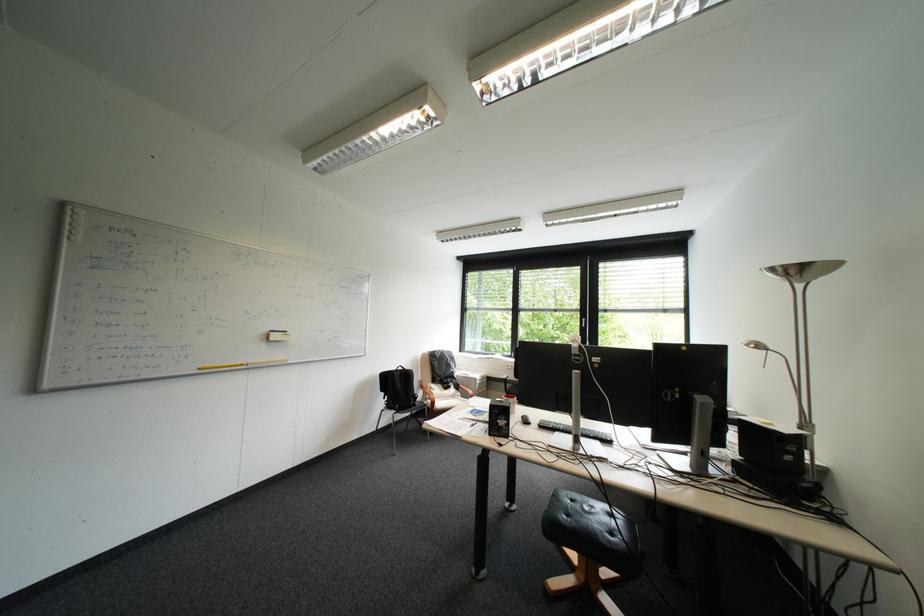
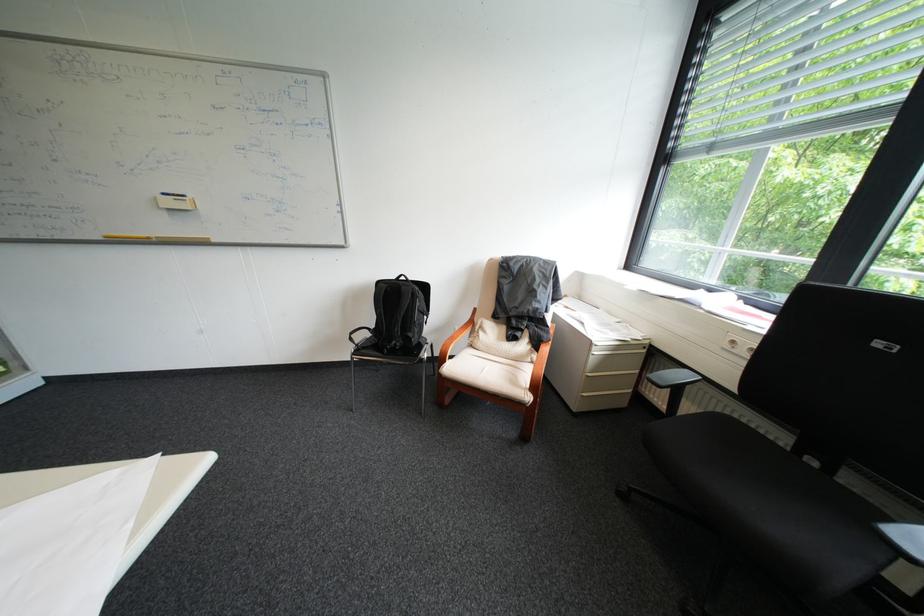
In the second image, find the point that corresponds to pixel 446 403 in the first image.

(456, 363)